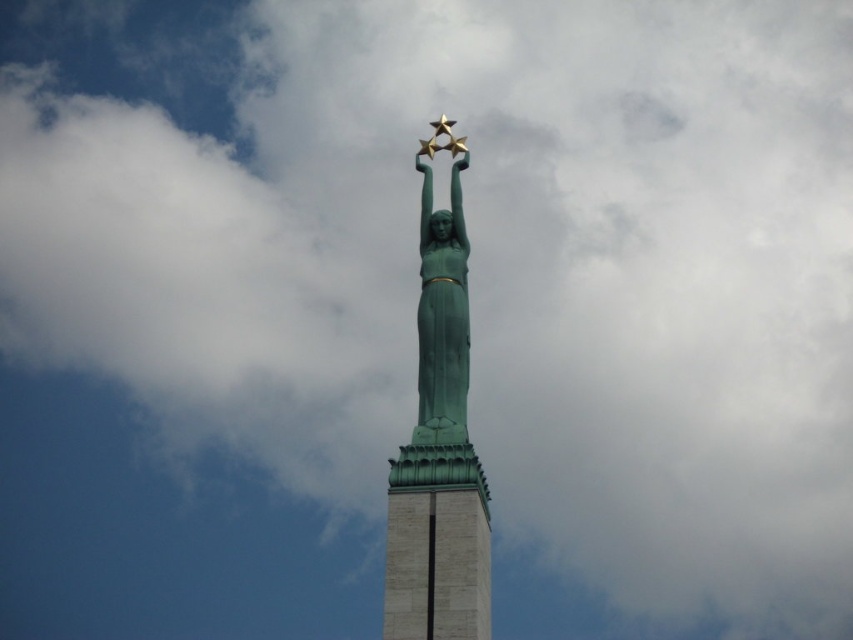
In the scene shown: Is green patina statue at center wider than green stone tower at center?

Yes, green patina statue at center is wider than green stone tower at center.

Is green patina statue at center to the right of green stone tower at center from the viewer's perspective?

In fact, green patina statue at center is to the left of green stone tower at center.

Is point (445, 552) behind point (460, 625)?

Yes, point (445, 552) is behind point (460, 625).

Identify the location of green patina statue at center. click(439, 445).